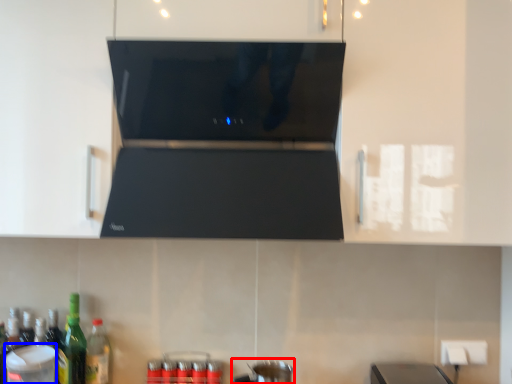
Question: Among these objects, which one is nearest to the camera, appliance (highlighted by a red box) or appliance (highlighted by a blue box)?

Choices:
 (A) appliance
 (B) appliance

Answer: (B)